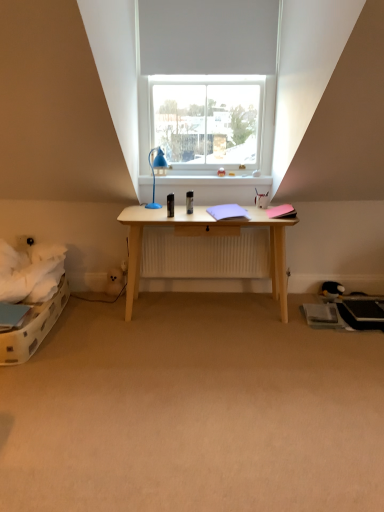
Question: Is beige carpet at center completely or partially outside of black plush toy at lower right?

Choices:
 (A) yes
 (B) no

Answer: (A)

Question: Are beige carpet at center and black plush toy at lower right located far from each other?

Choices:
 (A) yes
 (B) no

Answer: (A)

Question: Does beige carpet at center have a greater width compared to black plush toy at lower right?

Choices:
 (A) yes
 (B) no

Answer: (A)

Question: From a real-world perspective, is beige carpet at center positioned over black plush toy at lower right based on gravity?

Choices:
 (A) yes
 (B) no

Answer: (B)

Question: From a real-world perspective, is beige carpet at center below black plush toy at lower right?

Choices:
 (A) yes
 (B) no

Answer: (A)

Question: Is blue plastic lamp at center wider or thinner than white glossy window sill at upper center?

Choices:
 (A) wide
 (B) thin

Answer: (A)

Question: From a real-world perspective, is blue plastic lamp at center above or below white glossy window sill at upper center?

Choices:
 (A) below
 (B) above

Answer: (B)

Question: Relative to white glossy window sill at upper center, is blue plastic lamp at center in front or behind?

Choices:
 (A) behind
 (B) front

Answer: (B)

Question: From the image's perspective, relative to white glossy window sill at upper center, is blue plastic lamp at center above or below?

Choices:
 (A) above
 (B) below

Answer: (B)

Question: Based on their positions, is white matte window at upper center located to the left or right of white glossy window sill at upper center?

Choices:
 (A) left
 (B) right

Answer: (A)

Question: Is point (271, 122) closer or farther from the camera than point (264, 190)?

Choices:
 (A) closer
 (B) farther

Answer: (A)

Question: Is white matte window at upper center inside the boundaries of white glossy window sill at upper center, or outside?

Choices:
 (A) outside
 (B) inside

Answer: (A)

Question: From a real-world perspective, is white matte window at upper center physically located above or below white glossy window sill at upper center?

Choices:
 (A) above
 (B) below

Answer: (A)

Question: Considering their positions, is white glossy window sill at upper center located in front of or behind white matte window at upper center?

Choices:
 (A) behind
 (B) front

Answer: (A)

Question: In the image, is white glossy window sill at upper center on the left side or the right side of white matte window at upper center?

Choices:
 (A) right
 (B) left

Answer: (A)